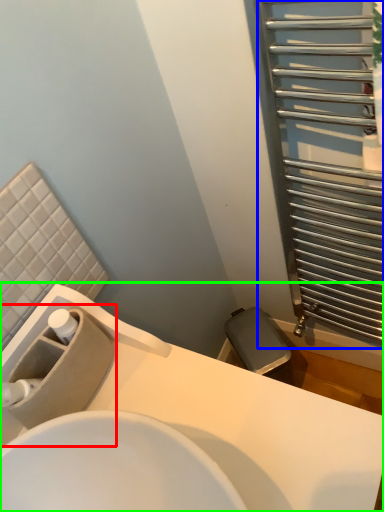
Question: Based on their relative distances, which object is nearer to sink (highlighted by a red box)? Choose from screen door (highlighted by a blue box) and sink (highlighted by a green box).

Choices:
 (A) screen door
 (B) sink

Answer: (B)